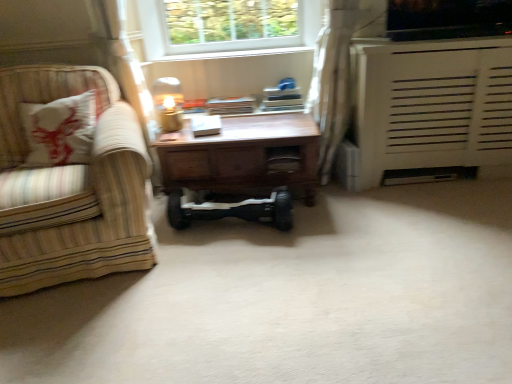
You are a GUI agent. You are given a task and a screenshot of the screen. Output one action in this format:
    pyautogui.click(x=<x>, y=<y>)
    Task: Click on the vacant region in front of black rubber hoverboard at center
    
    Given the screenshot: What is the action you would take?
    pyautogui.click(x=226, y=269)